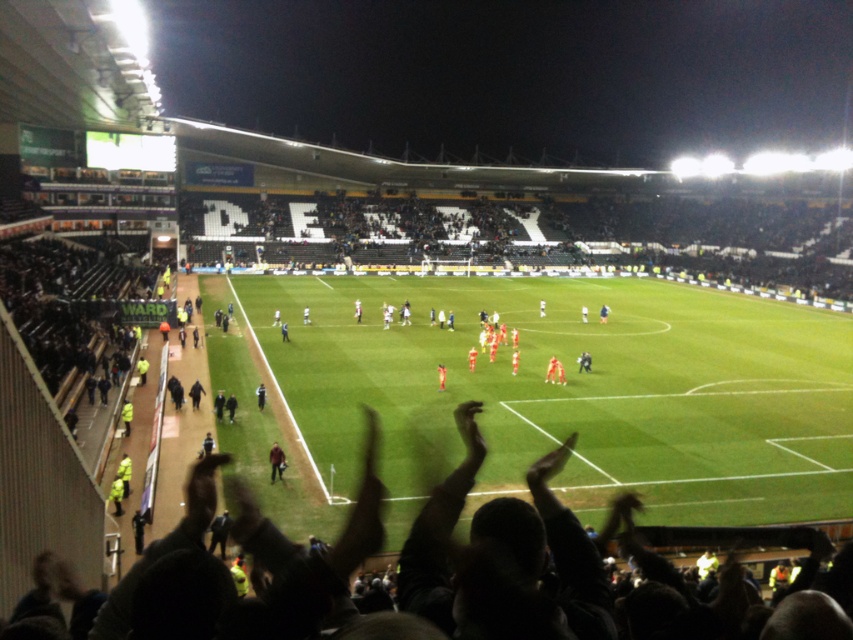
You are a photographer standing at the edge of the field. You want to take a photo that includes both the green grass football field at center and the brown leather jacket at center. Which object will appear wider in the photo?

The green grass football field at center will appear wider in the photo because its width is larger than that of the brown leather jacket at center.